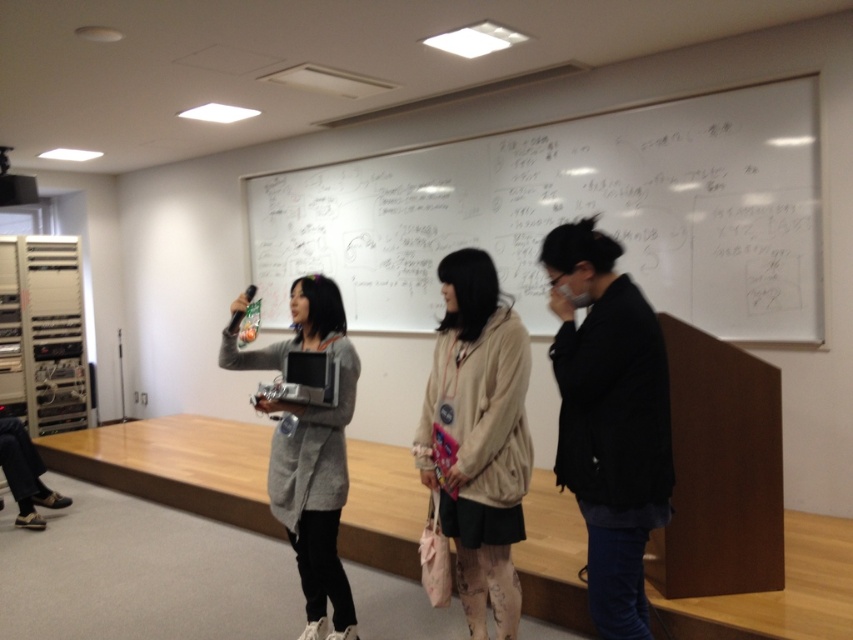
Question: Can you confirm if white matte whiteboard at upper center is thinner than beige fabric jacket at center?

Choices:
 (A) yes
 (B) no

Answer: (B)

Question: Which object is the farthest from the white matte whiteboard at upper center?

Choices:
 (A) gray matte cardigan at center
 (B) black matte jacket at center
 (C) beige fabric jacket at center

Answer: (B)

Question: Which point appears farthest from the camera in this image?

Choices:
 (A) (444, 280)
 (B) (352, 177)
 (C) (225, 349)
 (D) (648, 419)

Answer: (B)

Question: Does white matte whiteboard at upper center have a larger size compared to black matte jacket at center?

Choices:
 (A) yes
 (B) no

Answer: (A)

Question: Which point is closer to the camera?

Choices:
 (A) (311, 278)
 (B) (302, 232)
 (C) (468, 394)
 (D) (605, 412)

Answer: (D)

Question: Can you confirm if white matte whiteboard at upper center is positioned below black matte jacket at center?

Choices:
 (A) no
 (B) yes

Answer: (A)